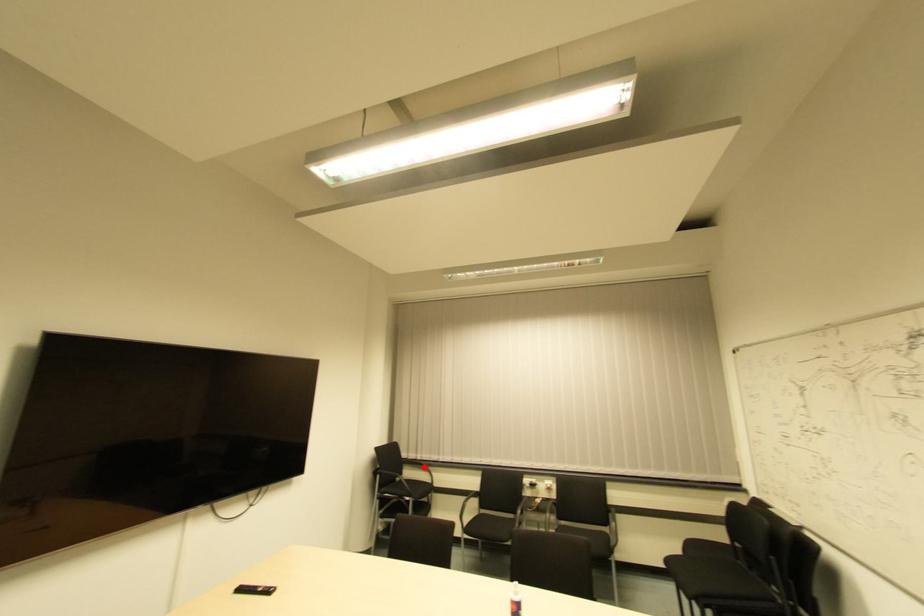
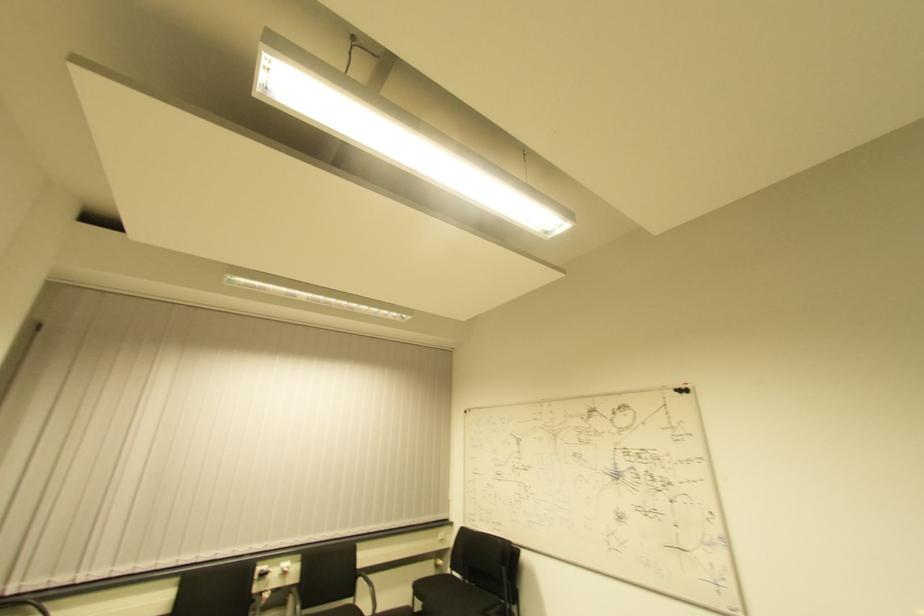
Question: A red point is marked in image1. In image2, is the corresponding 3D point closer to the camera or farther? Reply with the corresponding letter.

Choices:
 (A) The corresponding 3D point is closer.
 (B) The corresponding 3D point is farther.

Answer: (A)